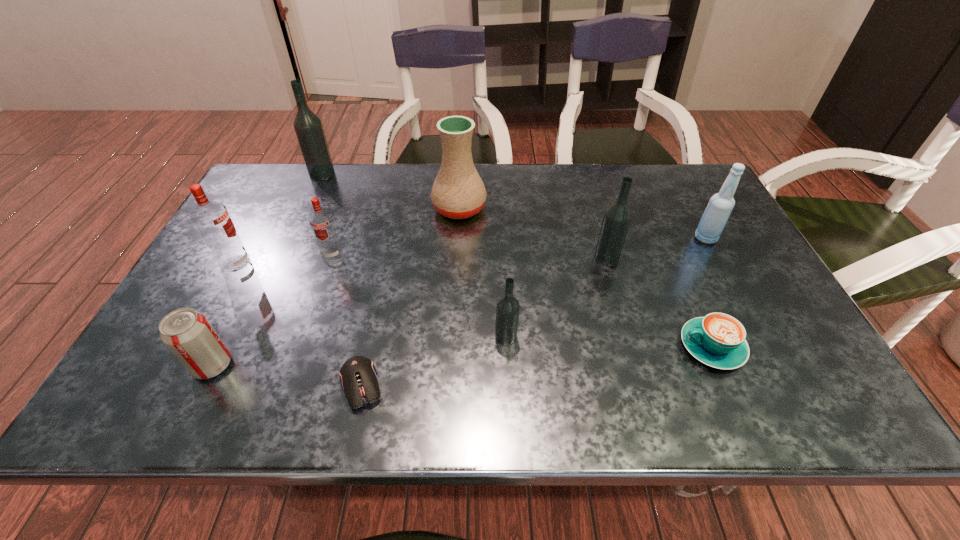
The width and height of the screenshot is (960, 540). Find the location of `free area in between the left red vodka and the tallest vodka`. free area in between the left red vodka and the tallest vodka is located at coordinates (279, 219).

The height and width of the screenshot is (540, 960). I want to click on vacant area that lies between the nearest black vodka and the computer mouse, so click(x=434, y=361).

At what (x,y) coordinates should I click in order to perform the action: click on vacant region between the third farthest object and the biggest black vodka. Please return your answer as a coordinate pair (x, y). This screenshot has width=960, height=540. Looking at the image, I should click on (514, 206).

Where is `free space between the soda can and the black computer mouse`? The image size is (960, 540). free space between the soda can and the black computer mouse is located at coordinates (287, 375).

Identify the location of free space between the pottery and the left red vodka. (348, 236).

The height and width of the screenshot is (540, 960). In order to click on free space between the rightmost object and the third object from right to left in this screenshot , I will do `click(656, 248)`.

You are a GUI agent. You are given a task and a screenshot of the screen. Output one action in this format:
    pyautogui.click(x=<x>, y=<y>)
    Task: Click on the object that stands as the second closest to the fifth object from right to left
    Image resolution: width=960 pixels, height=540 pixels.
    Given the screenshot: What is the action you would take?
    pyautogui.click(x=617, y=217)

Select which object appears as the second closest to the second black vodka from right to left. Please provide its 2D coordinates. Your answer should be formatted as a tuple, i.e. [(x, y)], where the tuple contains the x and y coordinates of a point satisfying the conditions above.

[(617, 217)]

This screenshot has width=960, height=540. I want to click on vodka object that ranks as the fourth closest to the eighth tallest object, so click(x=308, y=127).

At what (x,y) coordinates should I click in order to perform the action: click on vodka that is the second closest to the rightmost object. Please return your answer as a coordinate pair (x, y). Looking at the image, I should click on (507, 309).